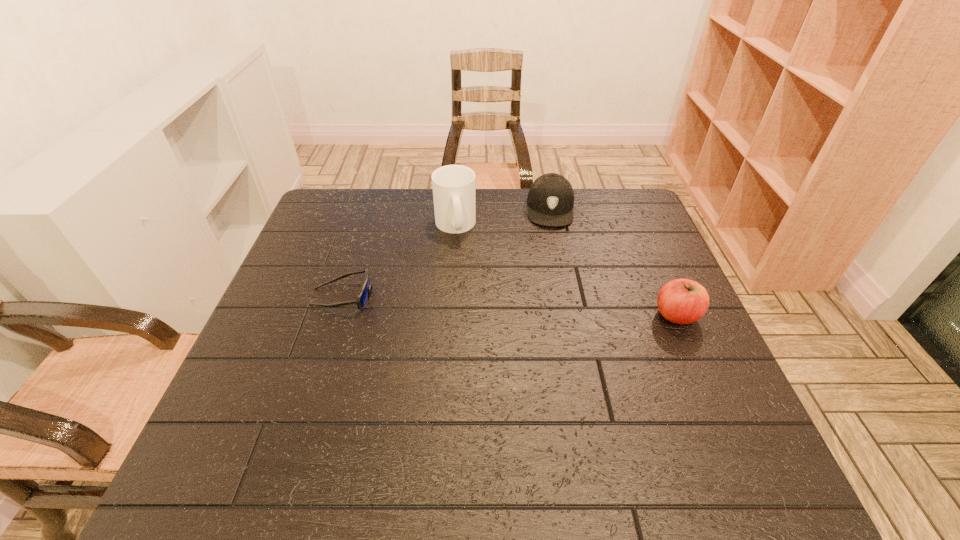
Where is `free spot between the apple and the sunglasses`? Image resolution: width=960 pixels, height=540 pixels. free spot between the apple and the sunglasses is located at coordinates (510, 306).

The image size is (960, 540). Identify the location of unoccupied area between the cap and the shortest object. (x=446, y=252).

What are the coordinates of `free point between the apple and the leftmost object` in the screenshot? It's located at (510, 306).

At what (x,y) coordinates should I click in order to perform the action: click on free space between the cap and the sunglasses. Please return your answer as a coordinate pair (x, y). This screenshot has height=540, width=960. Looking at the image, I should click on (446, 252).

The image size is (960, 540). I want to click on the closest object to the rightmost object, so click(x=550, y=198).

Point out which object is positioned as the nearest to the third object from right to left. Please provide its 2D coordinates. Your answer should be formatted as a tuple, i.e. [(x, y)], where the tuple contains the x and y coordinates of a point satisfying the conditions above.

[(550, 198)]

Locate an element on the screen. Image resolution: width=960 pixels, height=540 pixels. vacant space that satisfies the following two spatial constraints: 1. on the back side of the second object from left to right; 2. on the left side of the second object from right to left is located at coordinates (456, 208).